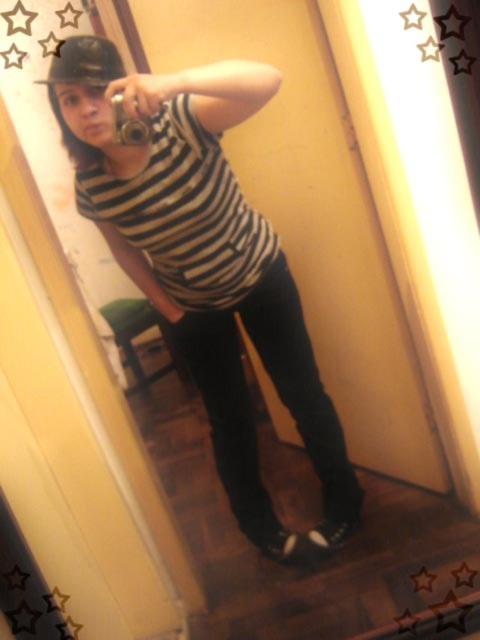
Question: Among these points, which one is nearest to the camera?

Choices:
 (A) (84, 51)
 (B) (218, 250)

Answer: (A)

Question: Does striped fabric shirt at center lie behind black matte baseball hat at upper left?

Choices:
 (A) yes
 (B) no

Answer: (A)

Question: Is striped fabric shirt at center above black matte baseball hat at upper left?

Choices:
 (A) yes
 (B) no

Answer: (B)

Question: Which of the following is the closest to the observer?

Choices:
 (A) (121, 186)
 (B) (57, 45)

Answer: (B)

Question: Which of the following is the closest to the observer?

Choices:
 (A) (99, 61)
 (B) (276, 237)

Answer: (A)

Question: Can you confirm if striped fabric shirt at center is wider than black matte baseball hat at upper left?

Choices:
 (A) yes
 (B) no

Answer: (A)